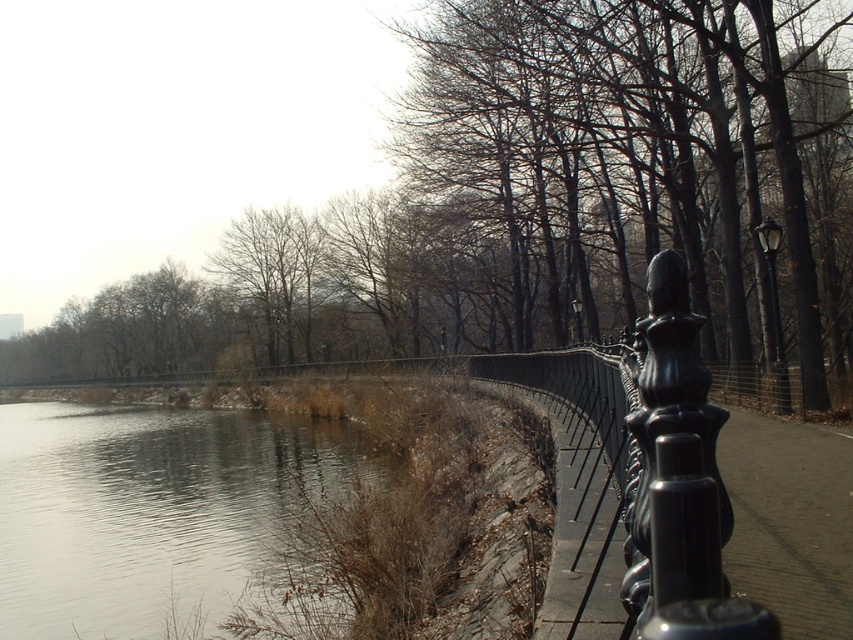
Question: Does brown leafless tree at center come in front of gray smooth water at lower left?

Choices:
 (A) no
 (B) yes

Answer: (A)

Question: Which point is closer to the camera?

Choices:
 (A) 427,24
 (B) 248,534

Answer: (B)

Question: Which point appears closest to the camera in this image?

Choices:
 (A) (582, 285)
 (B) (18, 621)

Answer: (B)

Question: Is brown leafless tree at center to the right of gray smooth water at lower left from the viewer's perspective?

Choices:
 (A) no
 (B) yes

Answer: (A)

Question: Does brown leafless tree at center appear over gray smooth water at lower left?

Choices:
 (A) no
 (B) yes

Answer: (B)